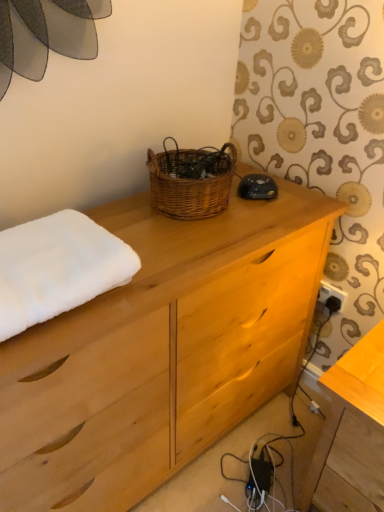
This screenshot has width=384, height=512. What do you see at coordinates (191, 181) in the screenshot?
I see `woven brown basket at center` at bounding box center [191, 181].

What is the approximate height of white fluffy towel at left?

It is 4.31 inches.

Identify the location of natural wood chest of drawers at center. The width and height of the screenshot is (384, 512). (161, 351).

Is natural wood chest of drawers at center oriented towards white fluffy towel at left?

No, natural wood chest of drawers at center is not oriented towards white fluffy towel at left.

Considering the relative sizes of natural wood chest of drawers at center and white fluffy towel at left in the image provided, is natural wood chest of drawers at center smaller than white fluffy towel at left?

Actually, natural wood chest of drawers at center might be larger than white fluffy towel at left.

Where is `the chest of drawers in front of the white fluffy towel at left`? The width and height of the screenshot is (384, 512). the chest of drawers in front of the white fluffy towel at left is located at coordinates (161, 351).

Looking at this image, in terms of height, does white plastic electric outlet at lower right look taller or shorter compared to woven brown basket at center?

Clearly, white plastic electric outlet at lower right is shorter compared to woven brown basket at center.

Is white plastic electric outlet at lower right far away from woven brown basket at center?

white plastic electric outlet at lower right is actually quite close to woven brown basket at center.

Considering the relative positions of white plastic electric outlet at lower right and woven brown basket at center in the image provided, is white plastic electric outlet at lower right to the right of woven brown basket at center from the viewer's perspective?

Correct, you'll find white plastic electric outlet at lower right to the right of woven brown basket at center.

Between white plastic electric outlet at lower right and woven brown basket at center, which one has larger size?

woven brown basket at center.

Does woven brown basket at center have a greater width compared to white fluffy towel at left?

No.

Is woven brown basket at center beside white fluffy towel at left?

No, woven brown basket at center is not making contact with white fluffy towel at left.

From a real-world perspective, which is physically above, woven brown basket at center or white fluffy towel at left?

From a 3D spatial view, woven brown basket at center is above.

Which of these two, natural wood chest of drawers at center or woven brown basket at center, is wider?

With larger width is natural wood chest of drawers at center.

Locate an element on the screen. picnic basket above the natural wood chest of drawers at center (from the image's perspective) is located at coordinates (191, 181).

Is natural wood chest of drawers at center touching woven brown basket at center?

No, natural wood chest of drawers at center is not next to woven brown basket at center.

Can you confirm if natural wood chest of drawers at center is bigger than woven brown basket at center?

Indeed, natural wood chest of drawers at center has a larger size compared to woven brown basket at center.

Does wooden table at lower right turn towards natural wood chest of drawers at center?

No, wooden table at lower right is not facing towards natural wood chest of drawers at center.

Between wooden table at lower right and natural wood chest of drawers at center, which one appears on the right side from the viewer's perspective?

From the viewer's perspective, wooden table at lower right appears more on the right side.

Is wooden table at lower right wider than natural wood chest of drawers at center?

Incorrect, the width of wooden table at lower right does not surpass that of natural wood chest of drawers at center.

From the picture: From the image's perspective, is wooden table at lower right located beneath natural wood chest of drawers at center?

Yes, from the image's perspective, wooden table at lower right is below natural wood chest of drawers at center.

Considering the sizes of objects woven brown basket at center and natural wood chest of drawers at center in the image provided, who is thinner, woven brown basket at center or natural wood chest of drawers at center?

Thinner between the two is woven brown basket at center.

From the image's perspective, which is above, woven brown basket at center or natural wood chest of drawers at center?

woven brown basket at center appears higher in the image.

Is the position of woven brown basket at center less distant than that of natural wood chest of drawers at center?

No.

Is white fluffy towel at left at the back of white plastic electric outlet at lower right?

No, white plastic electric outlet at lower right's orientation is not away from white fluffy towel at left.

In the scene shown: Is white plastic electric outlet at lower right not inside white fluffy towel at left?

That's correct, white plastic electric outlet at lower right is outside of white fluffy towel at left.

Is the depth of white plastic electric outlet at lower right less than that of white fluffy towel at left?

No, white plastic electric outlet at lower right is further to the viewer.

I want to click on chest of drawers to the right of white fluffy towel at left, so click(161, 351).

Identify the location of electric outlet directly beneath the woven brown basket at center (from a real-world perspective). The height and width of the screenshot is (512, 384). [331, 293].

From the image, which object appears to be nearer to white fluffy towel at left, wooden table at lower right or woven brown basket at center?

woven brown basket at center lies closer to white fluffy towel at left than the other object.

Estimate the real-world distances between objects in this image. Which object is closer to woven brown basket at center, natural wood chest of drawers at center or wooden table at lower right?

Based on the image, natural wood chest of drawers at center appears to be nearer to woven brown basket at center.

Which object lies further to the anchor point woven brown basket at center, white fluffy towel at left or natural wood chest of drawers at center?

Based on the image, white fluffy towel at left appears to be further to woven brown basket at center.

Looking at the image, which one is located further to white fluffy towel at left, white plastic electric outlet at lower right or woven brown basket at center?

Based on the image, white plastic electric outlet at lower right appears to be further to white fluffy towel at left.

Considering their positions, is woven brown basket at center positioned further to natural wood chest of drawers at center than white fluffy towel at left?

woven brown basket at center is further to natural wood chest of drawers at center.

From the picture: When comparing their distances from white plastic electric outlet at lower right, does natural wood chest of drawers at center or white fluffy towel at left seem further?

Among the two, white fluffy towel at left is located further to white plastic electric outlet at lower right.

Considering their positions, is woven brown basket at center positioned further to natural wood chest of drawers at center than white plastic electric outlet at lower right?

white plastic electric outlet at lower right.

Estimate the real-world distances between objects in this image. Which object is closer to wooden table at lower right, white plastic electric outlet at lower right or woven brown basket at center?

white plastic electric outlet at lower right is closer to wooden table at lower right.

In order to click on picnic basket between natural wood chest of drawers at center and white plastic electric outlet at lower right in the front-back direction in this screenshot , I will do `click(191, 181)`.

Where is `picnic basket situated between white fluffy towel at left and white plastic electric outlet at lower right from left to right`? The width and height of the screenshot is (384, 512). picnic basket situated between white fluffy towel at left and white plastic electric outlet at lower right from left to right is located at coordinates (191, 181).

The image size is (384, 512). Identify the location of electric outlet located between white fluffy towel at left and wooden table at lower right in the left-right direction. (331, 293).

I want to click on bath towel between natural wood chest of drawers at center and white plastic electric outlet at lower right in the front-back direction, so click(57, 268).